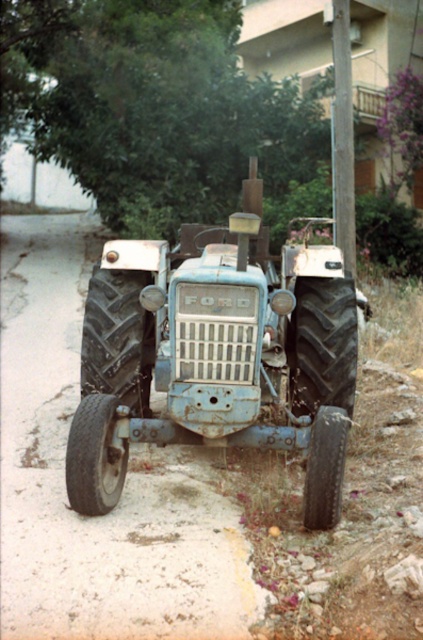
Question: Is rusty blue tractor at center to the right of smooth wooden pole at upper center from the viewer's perspective?

Choices:
 (A) yes
 (B) no

Answer: (B)

Question: Which of the following is the closest to the observer?

Choices:
 (A) rusty blue tractor at center
 (B) smooth wooden pole at upper center

Answer: (A)

Question: Does rusty blue tractor at center appear on the left side of smooth wooden pole at upper center?

Choices:
 (A) yes
 (B) no

Answer: (A)

Question: Observing the image, what is the correct spatial positioning of rusty blue tractor at center in reference to smooth wooden pole at upper center?

Choices:
 (A) above
 (B) below

Answer: (B)

Question: Which of the following is the closest to the observer?

Choices:
 (A) (332, 337)
 (B) (342, 67)

Answer: (A)